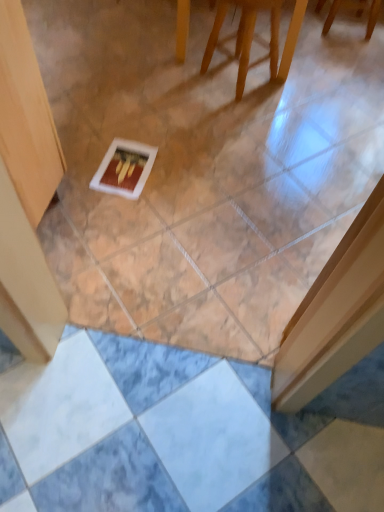
The height and width of the screenshot is (512, 384). Find the location of `white matte postcard at center`. white matte postcard at center is located at coordinates (124, 168).

Where is `wooden chair at upper center, which appears as the 2th furniture when viewed from the left`? wooden chair at upper center, which appears as the 2th furniture when viewed from the left is located at coordinates 344,8.

From the picture: Which of these two, wooden chair at upper center, which is counted as the second furniture, starting from the front, or white matte postcard at center, is smaller?

white matte postcard at center is smaller.

Which furniture is the 2nd one when counting from the right side of the white matte postcard at center? Please provide its 2D coordinates.

[(344, 8)]

In the scene shown: Between wooden chair at upper center, the first furniture viewed from the back, and white matte postcard at center, which one is positioned in front?

white matte postcard at center.

From the image's perspective, which is below, wooden chair at upper center, which is the first furniture in top-to-bottom order, or white matte postcard at center?

white matte postcard at center is shown below in the image.

Is wooden chair at upper center, the first furniture from the front, in contact with wooden chair at upper center, which appears as the 2th furniture when viewed from the left?

No, wooden chair at upper center, the first furniture from the front, is not next to wooden chair at upper center, which appears as the 2th furniture when viewed from the left.

From the picture: Is the position of wooden chair at upper center, which ranks as the first furniture in left-to-right order, less distant than that of wooden chair at upper center, which is counted as the second furniture, starting from the front?

Yes, wooden chair at upper center, which ranks as the first furniture in left-to-right order, is closer to the camera.

From the image's perspective, is wooden chair at upper center, marked as the 2th furniture in a back-to-front arrangement, positioned above or below wooden chair at upper center, which is counted as the second furniture, starting from the front?

From the image's perspective, wooden chair at upper center, marked as the 2th furniture in a back-to-front arrangement, appears below wooden chair at upper center, which is counted as the second furniture, starting from the front.

Is point (217, 41) behind point (371, 15)?

No, (217, 41) is closer to viewer.

Looking at their sizes, would you say white matte postcard at center is wider or thinner than wooden chair at upper center, marked as the 2th furniture in a back-to-front arrangement?

Considering their sizes, white matte postcard at center looks broader than wooden chair at upper center, marked as the 2th furniture in a back-to-front arrangement.

Looking at this image, from the image's perspective, between white matte postcard at center and wooden chair at upper center, which is the 1th furniture from bottom to top, who is located below?

white matte postcard at center, from the image's perspective.

Is white matte postcard at center facing away from wooden chair at upper center, which is the 1th furniture from bottom to top?

No.

From a real-world perspective, is white matte postcard at center physically located above or below wooden chair at upper center, the first furniture from the front?

From a real-world perspective, white matte postcard at center is physically below wooden chair at upper center, the first furniture from the front.

Considering the sizes of objects wooden chair at upper center, the first furniture from the front, and white matte postcard at center in the image provided, who is taller, wooden chair at upper center, the first furniture from the front, or white matte postcard at center?

Standing taller between the two is wooden chair at upper center, the first furniture from the front.

What's the angular difference between wooden chair at upper center, which is the 1th furniture from bottom to top, and white matte postcard at center's facing directions?

There is a 29.3-degree angle between the facing directions of wooden chair at upper center, which is the 1th furniture from bottom to top, and white matte postcard at center.

Is white matte postcard at center a part of wooden chair at upper center, marked as the 2th furniture in a back-to-front arrangement?

No, white matte postcard at center is not inside wooden chair at upper center, marked as the 2th furniture in a back-to-front arrangement.

Is wooden chair at upper center, the first furniture in the right-to-left sequence, further to the viewer compared to wooden chair at upper center, the second furniture from the right?

Yes, wooden chair at upper center, the first furniture in the right-to-left sequence, is behind wooden chair at upper center, the second furniture from the right.

Is the surface of wooden chair at upper center, which appears as the 2th furniture when viewed from the left, in direct contact with wooden chair at upper center, arranged as the 2th furniture when viewed from the top?

No.

Can you confirm if wooden chair at upper center, which is counted as the second furniture, starting from the front, is taller than wooden chair at upper center, the second furniture from the right?

Incorrect, the height of wooden chair at upper center, which is counted as the second furniture, starting from the front, is not larger of that of wooden chair at upper center, the second furniture from the right.

Which is closer, (321, 7) or (242, 24)?

Point (321, 7) is farther from the camera than point (242, 24).

Can you tell me how much white matte postcard at center and wooden chair at upper center, which is counted as the second furniture, starting from the front, differ in facing direction?

104 degrees.

From the image's perspective, is white matte postcard at center above or below wooden chair at upper center, which appears as the 2th furniture when viewed from the left?

white matte postcard at center is below wooden chair at upper center, which appears as the 2th furniture when viewed from the left.

Is wooden chair at upper center, the first furniture viewed from the back, completely or partially inside white matte postcard at center?

That's incorrect, wooden chair at upper center, the first furniture viewed from the back, is not inside white matte postcard at center.

Considering the positions of points (119, 143) and (320, 10), is point (119, 143) farther from camera compared to point (320, 10)?

That is False.

Image resolution: width=384 pixels, height=512 pixels. I want to click on postcard below the wooden chair at upper center, which is counted as the second furniture, starting from the front (from a real-world perspective), so click(x=124, y=168).

You are a GUI agent. You are given a task and a screenshot of the screen. Output one action in this format:
    pyautogui.click(x=<x>, y=<y>)
    Task: Click on the furniture on the left of wooden chair at upper center, the first furniture in the right-to-left sequence
    
    Given the screenshot: What is the action you would take?
    pyautogui.click(x=256, y=37)

When comparing their distances from wooden chair at upper center, arranged as the 2th furniture when viewed from the top, does wooden chair at upper center, the second furniture ordered from the bottom, or white matte postcard at center seem closer?

The object closer to wooden chair at upper center, arranged as the 2th furniture when viewed from the top, is wooden chair at upper center, the second furniture ordered from the bottom.

Which object lies nearer to the anchor point wooden chair at upper center, which is counted as the second furniture, starting from the front, wooden chair at upper center, marked as the 2th furniture in a back-to-front arrangement, or white matte postcard at center?

wooden chair at upper center, marked as the 2th furniture in a back-to-front arrangement, is closer to wooden chair at upper center, which is counted as the second furniture, starting from the front.

When comparing their distances from wooden chair at upper center, which ranks as the first furniture in left-to-right order, does white matte postcard at center or wooden chair at upper center, which is the first furniture in top-to-bottom order, seem further?

white matte postcard at center.

Which object lies further to the anchor point white matte postcard at center, wooden chair at upper center, the second furniture from the right, or wooden chair at upper center, the second furniture ordered from the bottom?

Among the two, wooden chair at upper center, the second furniture ordered from the bottom, is located further to white matte postcard at center.

When comparing their distances from white matte postcard at center, does wooden chair at upper center, which appears as the 2th furniture when viewed from the left, or wooden chair at upper center, marked as the 2th furniture in a back-to-front arrangement, seem further?

Based on the image, wooden chair at upper center, which appears as the 2th furniture when viewed from the left, appears to be further to white matte postcard at center.

Estimate the real-world distances between objects in this image. Which object is further from wooden chair at upper center, which is counted as the second furniture, starting from the front, white matte postcard at center or wooden chair at upper center, the second furniture from the right?

white matte postcard at center is positioned further to the anchor wooden chair at upper center, which is counted as the second furniture, starting from the front.

Locate an element on the screen. The width and height of the screenshot is (384, 512). furniture situated between white matte postcard at center and wooden chair at upper center, the second furniture ordered from the bottom, from left to right is located at coordinates [x=256, y=37].